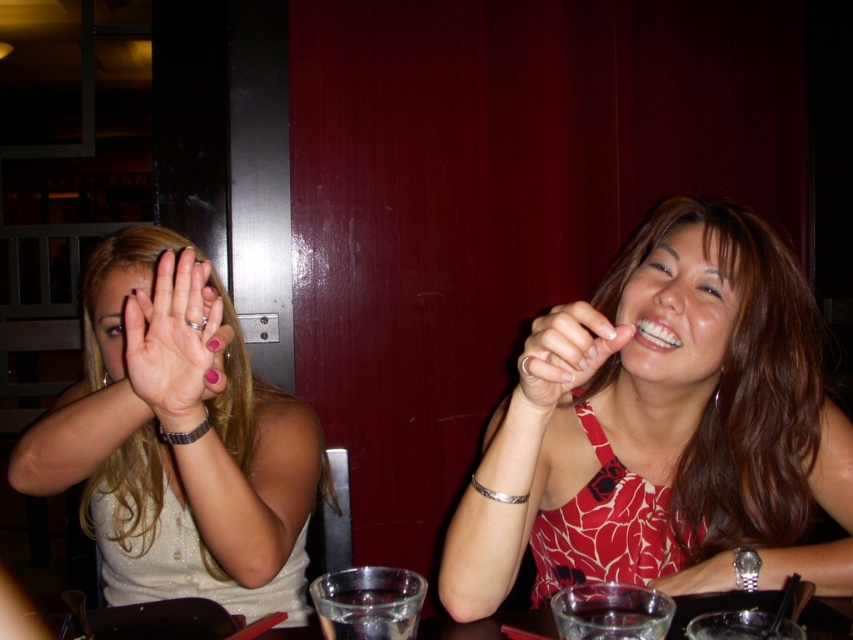
Between matte white blouse at center and pink matte nail polish at center, which one is positioned higher?

pink matte nail polish at center is higher up.

Can you confirm if matte white blouse at center is bigger than pink matte nail polish at center?

Yes, matte white blouse at center is bigger than pink matte nail polish at center.

Where is `matte white blouse at center`? The height and width of the screenshot is (640, 853). matte white blouse at center is located at coordinates (178, 440).

What do you see at coordinates (662, 428) in the screenshot? I see `red floral dress at center` at bounding box center [662, 428].

Is point (682, 474) positioned behind point (109, 305)?

No, (682, 474) is closer to viewer.

Describe the element at coordinates (662, 428) in the screenshot. I see `red floral dress at center` at that location.

At what (x,y) coordinates should I click in order to perform the action: click on red floral dress at center. Please return your answer as a coordinate pair (x, y). This screenshot has height=640, width=853. Looking at the image, I should click on (662, 428).

The height and width of the screenshot is (640, 853). What are the coordinates of `matte white blouse at center` in the screenshot? It's located at (x=178, y=440).

Which of these two, matte white blouse at center or smooth silver ring at center, stands shorter?

smooth silver ring at center is shorter.

Between point (230, 573) and point (553, 321), which one is positioned in front?

Point (553, 321)

Identify the location of matte white blouse at center. This screenshot has height=640, width=853. (178, 440).